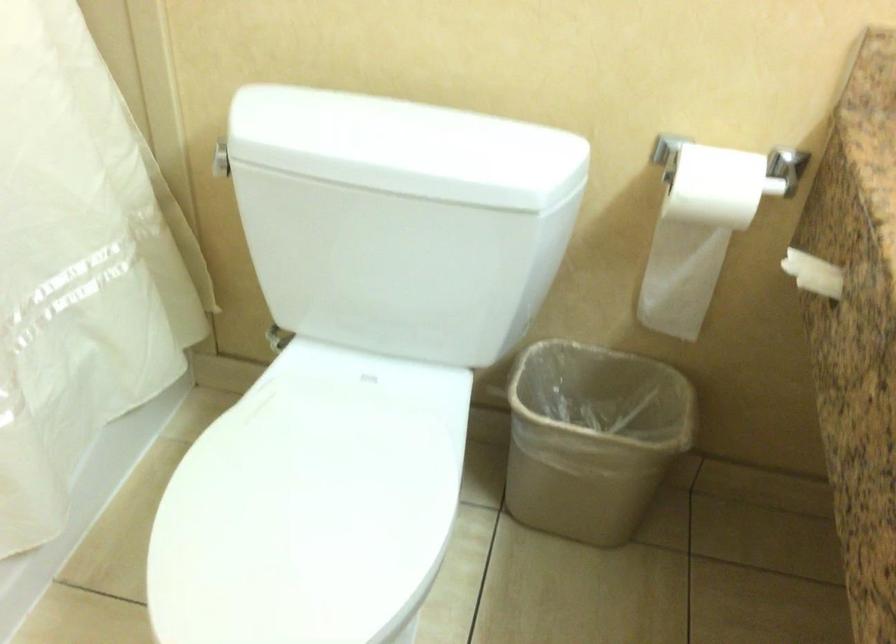
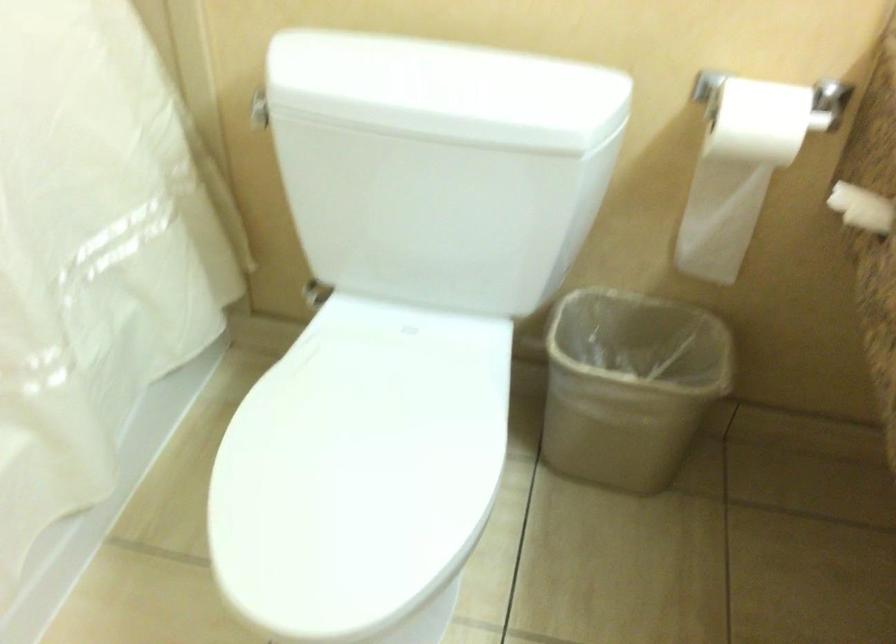
Question: How did the camera likely rotate?

Choices:
 (A) Left
 (B) Right
 (C) Up
 (D) Down

Answer: (D)